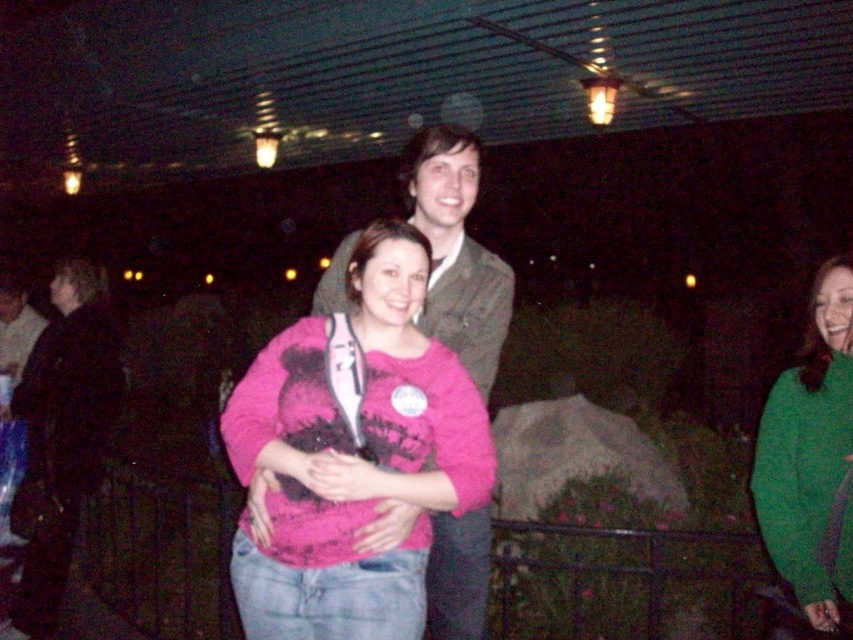
You are at a nighttime event and want to take a photo of the point at coordinates (230, 413). If your camera has a focal length of 50mm and the sensor size is 24mm wide, what is the minimum distance you need to be from the point to ensure it fits entirely within a 600mm wide frame?

The distance of point (230, 413) from the camera is 2.02 meters. To calculate the minimum distance required, use the formula distance > sensor size multiplied by frame width divided by focal length. Plugging in the numbers, 24mm x 600mm divided by 50mm equals 288mm, so the minimum distance should be greater than 0.288 meters. Since the current distance is 2.02 meters, which is greater than 0.288 meters, the point will fit within the frame.

You are standing in the nighttime gathering and want to find the pink fleece sweater at center. Based on its 2D coordinates, which direction should you look to locate it?

The pink fleece sweater at center is located at the 2D coordinates point (x=352, y=454), so you should look towards the lower right direction to find it.